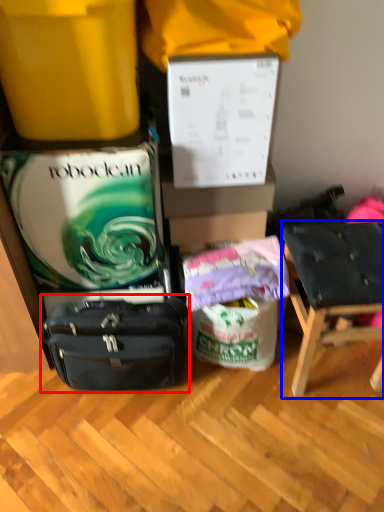
Question: Which object appears farthest to the camera in this image, luggage and bags (highlighted by a red box) or chair (highlighted by a blue box)?

Choices:
 (A) luggage and bags
 (B) chair

Answer: (A)